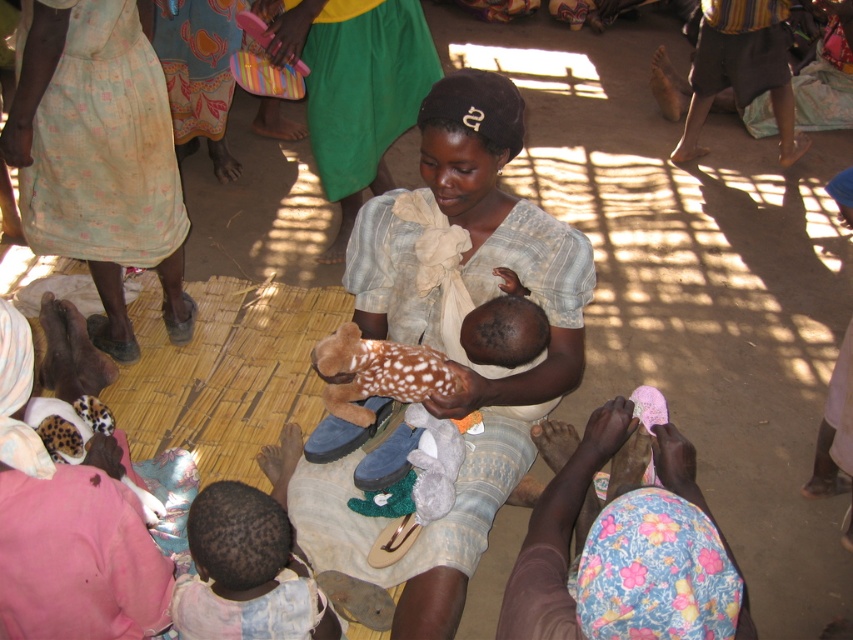
Question: Is dark skin baby at lower left bigger than brown plush toy at center?

Choices:
 (A) no
 (B) yes

Answer: (B)

Question: Can you confirm if dark skin baby at lower left is positioned below brown plush toy at center?

Choices:
 (A) no
 (B) yes

Answer: (B)

Question: Which object is closer to the camera taking this photo?

Choices:
 (A) fluffy pink cloth at lower center
 (B) brown plush toy at center
 (C) dark skin baby at lower left
 (D) light beige cotton dress at upper left

Answer: (A)

Question: Which point appears farthest from the camera in this image?

Choices:
 (A) (350, 356)
 (B) (341, 492)
 (C) (102, 58)

Answer: (C)

Question: Does matte fabric baby at center appear under brown plush toy at center?

Choices:
 (A) yes
 (B) no

Answer: (B)

Question: Which object appears farthest from the camera in this image?

Choices:
 (A) matte fabric baby at center
 (B) dark skin baby at lower left

Answer: (A)